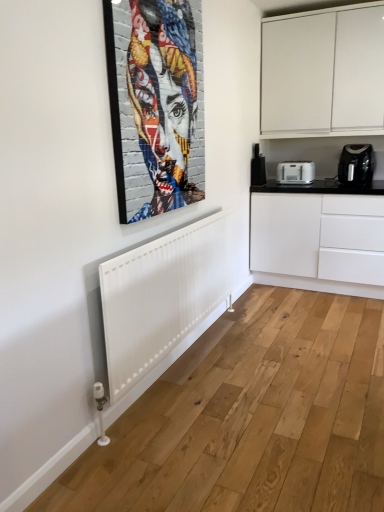
Question: From the image's perspective, is black glossy countertop at right beneath black plastic coffee maker at right, which is counted as the 1th home appliance, starting from the right?

Choices:
 (A) yes
 (B) no

Answer: (A)

Question: Is black glossy countertop at right oriented away from black plastic coffee maker at right, which is counted as the 1th home appliance, starting from the right?

Choices:
 (A) yes
 (B) no

Answer: (B)

Question: Is black glossy countertop at right taller than black plastic coffee maker at right, which is counted as the 1th home appliance, starting from the right?

Choices:
 (A) no
 (B) yes

Answer: (B)

Question: Is black glossy countertop at right completely or partially outside of black plastic coffee maker at right, which is counted as the second home appliance, starting from the left?

Choices:
 (A) yes
 (B) no

Answer: (A)

Question: Can you confirm if black glossy countertop at right is thinner than black plastic coffee maker at right, which is counted as the second home appliance, starting from the left?

Choices:
 (A) yes
 (B) no

Answer: (B)

Question: Does black glossy countertop at right appear on the left side of black plastic coffee maker at right, which is counted as the 1th home appliance, starting from the right?

Choices:
 (A) no
 (B) yes

Answer: (B)

Question: From a real-world perspective, is white matte cabinet at upper right positioned under black glossy countertop at right based on gravity?

Choices:
 (A) no
 (B) yes

Answer: (A)

Question: Can you confirm if white matte cabinet at upper right is thinner than black glossy countertop at right?

Choices:
 (A) no
 (B) yes

Answer: (B)

Question: Is white matte cabinet at upper right taller than black glossy countertop at right?

Choices:
 (A) yes
 (B) no

Answer: (A)

Question: From a real-world perspective, is white matte cabinet at upper right on black glossy countertop at right?

Choices:
 (A) no
 (B) yes

Answer: (B)

Question: Is white matte cabinet at upper right looking in the opposite direction of black glossy countertop at right?

Choices:
 (A) no
 (B) yes

Answer: (A)

Question: Is white matte cabinet at upper right shorter than black glossy countertop at right?

Choices:
 (A) yes
 (B) no

Answer: (B)

Question: From a real-world perspective, does black glossy countertop at right sit lower than white matte cabinet at upper right?

Choices:
 (A) yes
 (B) no

Answer: (A)